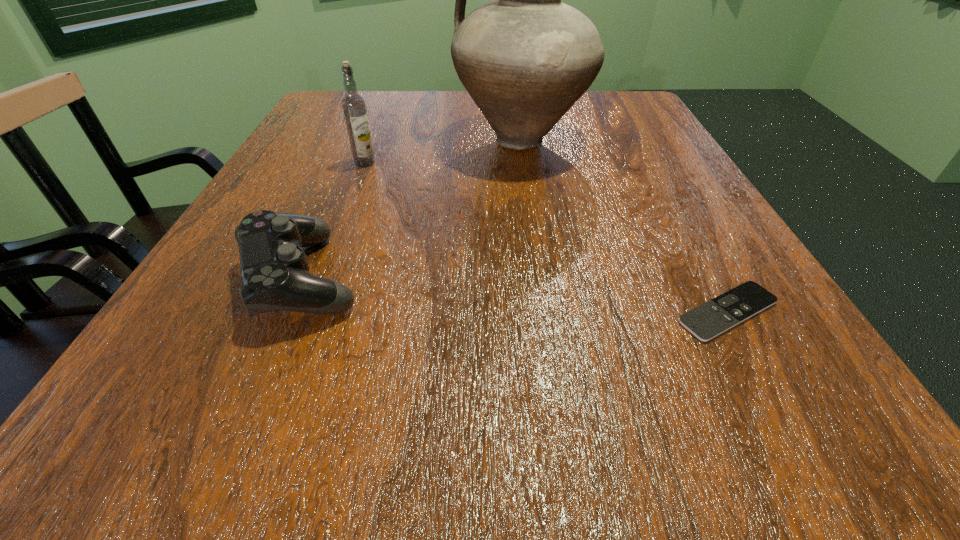
Identify the location of pitcher. The image size is (960, 540). (525, 58).

Locate an element on the screen. the tallest object is located at coordinates (525, 58).

You are a GUI agent. You are given a task and a screenshot of the screen. Output one action in this format:
    pyautogui.click(x=<x>, y=<y>)
    Task: Click on the vodka
    
    Given the screenshot: What is the action you would take?
    pyautogui.click(x=354, y=108)

Find the location of `the second shortest object`. the second shortest object is located at coordinates click(275, 273).

The image size is (960, 540). I want to click on remote control, so click(712, 318).

The height and width of the screenshot is (540, 960). Find the location of `the rightmost object`. the rightmost object is located at coordinates (712, 318).

I want to click on vacant region located 0.240m on the handle side of the pitcher, so click(343, 140).

You are a GUI agent. You are given a task and a screenshot of the screen. Output one action in this format:
    pyautogui.click(x=<x>, y=<y>)
    Task: Click on the free location located 0.100m on the handle side of the pitcher
    The image size is (960, 540).
    Given the screenshot: What is the action you would take?
    [x=408, y=140]

This screenshot has width=960, height=540. Identify the location of vacant space located on the handle side of the pitcher. (361, 140).

The image size is (960, 540). Identify the location of free space located on the label of the third shortest object. (353, 193).